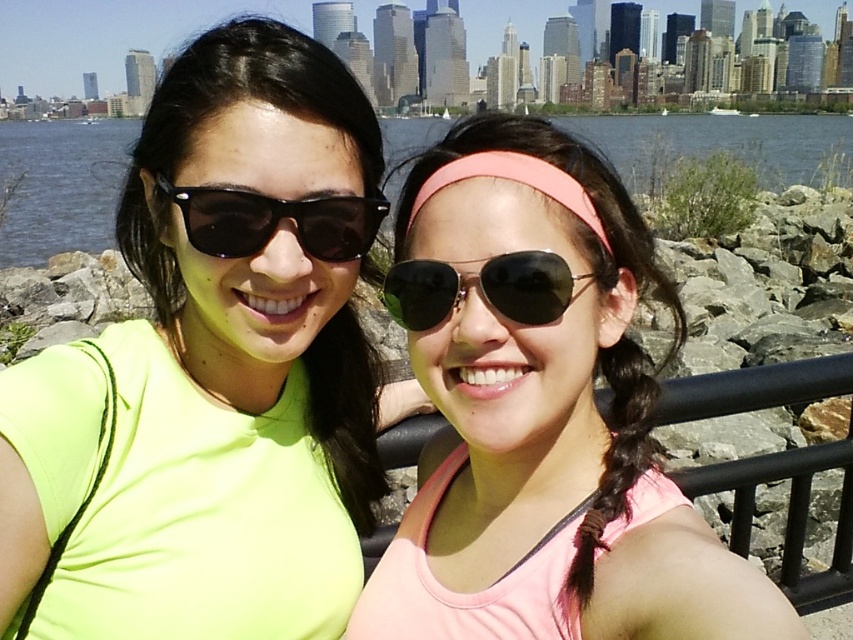
Question: Among these points, which one is farthest from the camera?

Choices:
 (A) (792, 547)
 (B) (556, 186)

Answer: (A)

Question: Which object appears closest to the camera in this image?

Choices:
 (A) metallic reflective sunglasses at center
 (B) pink fabric headband at center

Answer: (B)

Question: Where is pink matte headband at center located in relation to black reflective sunglasses at left in the image?

Choices:
 (A) above
 (B) below

Answer: (B)

Question: Is pink matte headband at center closer to the viewer compared to metallic reflective sunglasses at center?

Choices:
 (A) yes
 (B) no

Answer: (A)

Question: Which point is closer to the camera?

Choices:
 (A) (462, 160)
 (B) (842, 593)
 (C) (582, 275)
 (D) (445, 288)

Answer: (C)

Question: Considering the relative positions of neon yellow shirt at center and metallic reflective sunglasses at center in the image provided, where is neon yellow shirt at center located with respect to metallic reflective sunglasses at center?

Choices:
 (A) left
 (B) right

Answer: (A)